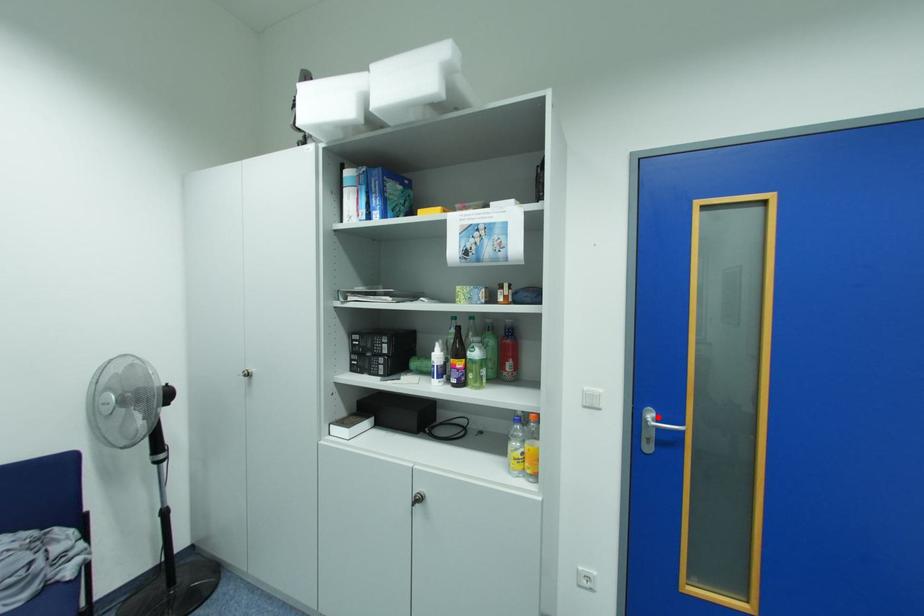
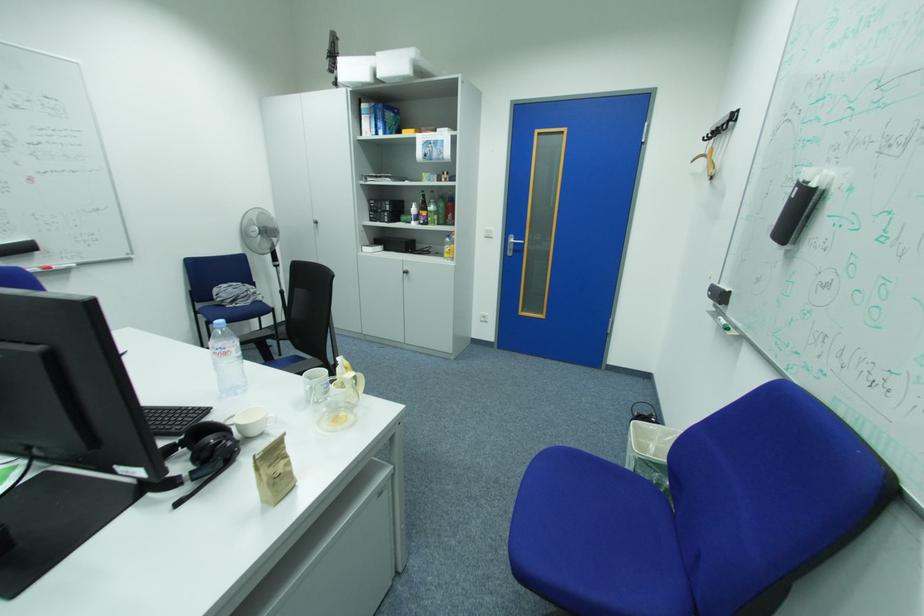
Where in the second image is the point corresponding to the highlighted location from the first image?

(520, 240)